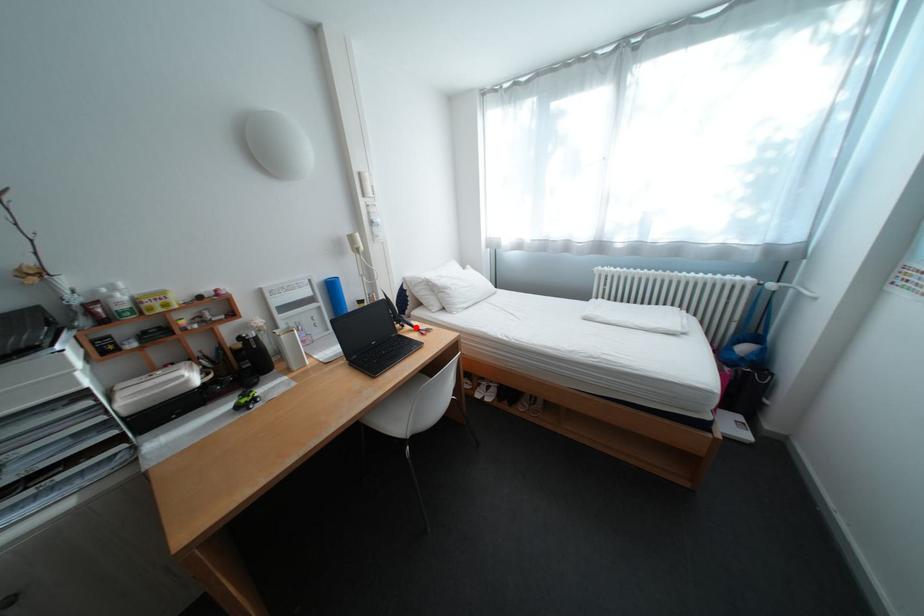
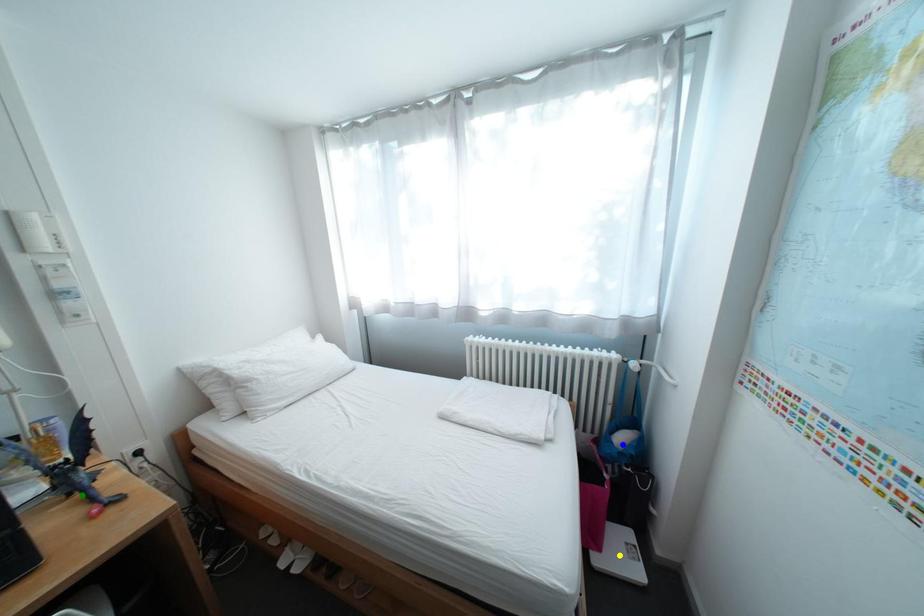
Question: I am providing you with two images of the same scene from different viewpoints. A red point is marked on the first image. You are given multiple points on the second image. Can you choose the point in image 2 that corresponds to the point in image 1?

Choices:
 (A) blue point
 (B) green point
 (C) yellow point

Answer: (B)